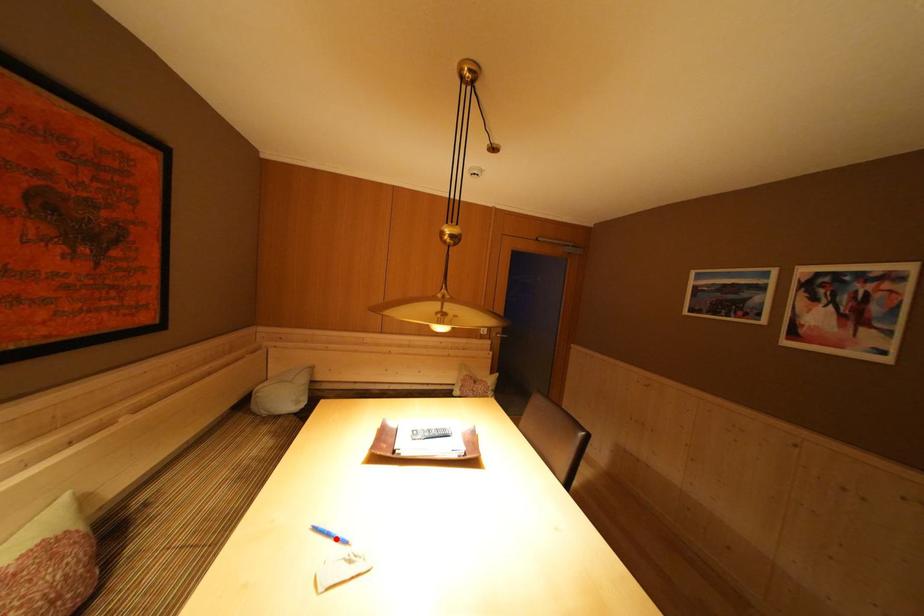
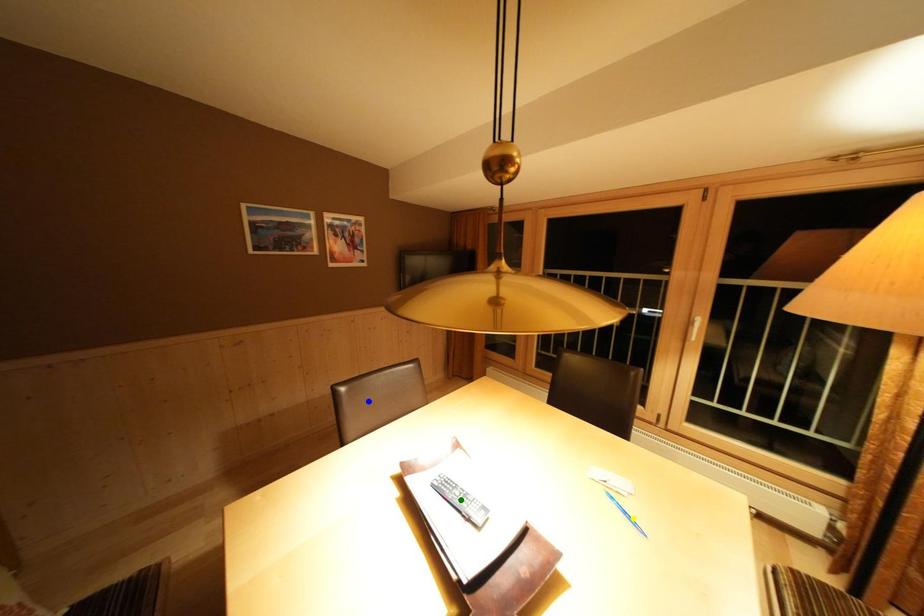
Question: I am providing you with two images of the same scene from different viewpoints. A red point is marked on the first image. You are given multiple points on the second image. Can you choose the point in image 2 that corresponds to the point in image 1?

Choices:
 (A) blue point
 (B) green point
 (C) yellow point

Answer: (C)